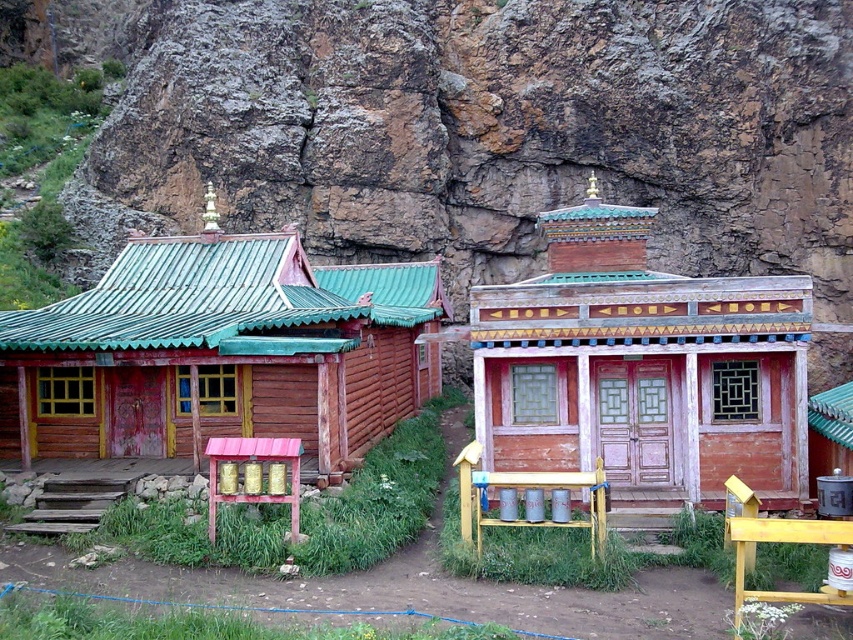
You are planning to place a large sculpture between the wooden cabin at left and the wooden cabin at center. Given their widths, which cabin should the sculpture be closer to, and why?

The sculpture should be placed closer to the wooden cabin at center because the wooden cabin at left is wider than the wooden cabin at center, so the space between them is narrower near the center cabin.

You are a traveler standing in front of the wooden cabin at left and the wooden cabin at center. Which cabin is closer to you?

The wooden cabin at left is closer to you because it is in front of the wooden cabin at center.

You are standing in front of the two wooden structures and want to determine which point is closer to you. The first point is at coordinates point (315, 298) and the second is at point (531, 408). Which point is closer to your position?

Point (315, 298) is closer to you than point (531, 408) because it is further to the viewer in the image.